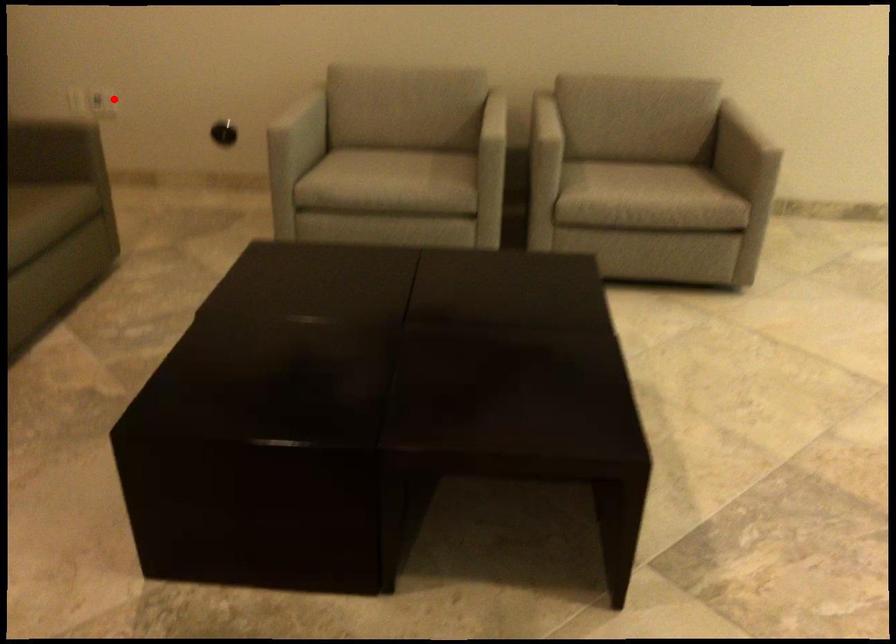
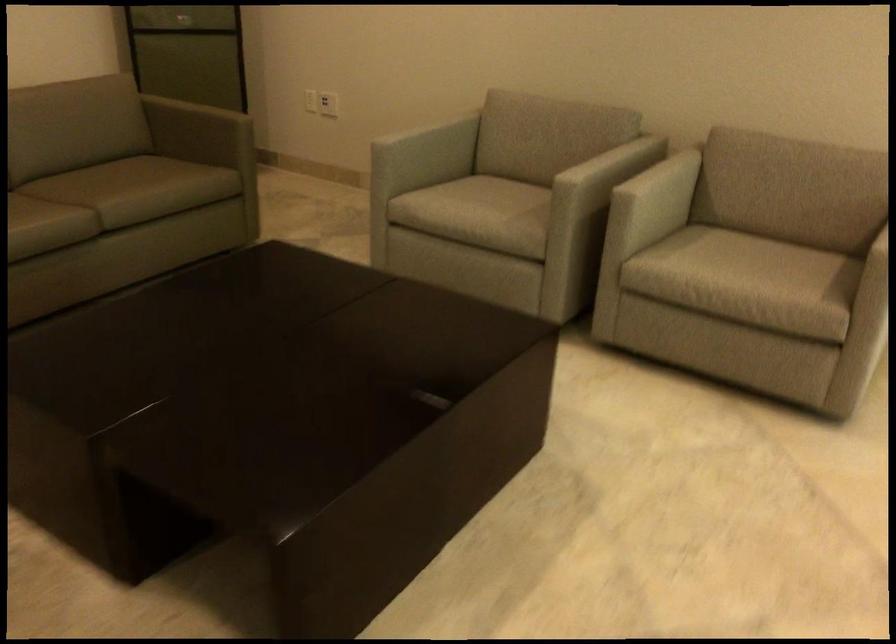
Question: I am providing you with two images of the same scene from different viewpoints. Image1 has a red point marked. In image2, the corresponding 3D location appears at what relative position? Reply with the corresponding letter.

Choices:
 (A) Closer
 (B) Farther

Answer: (B)